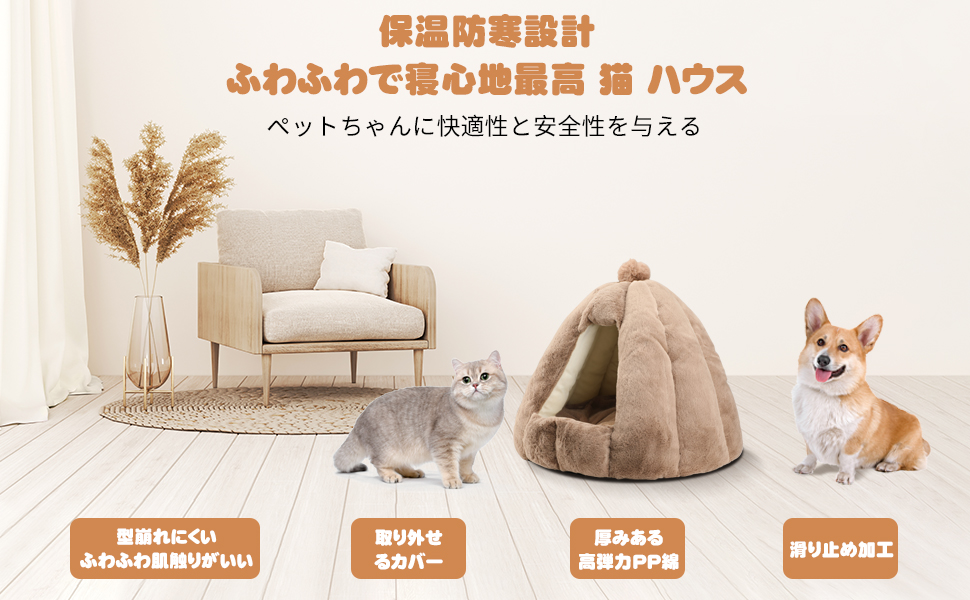
Where is `plant`? This screenshot has height=600, width=970. plant is located at coordinates (122, 219), (164, 193), (196, 201).